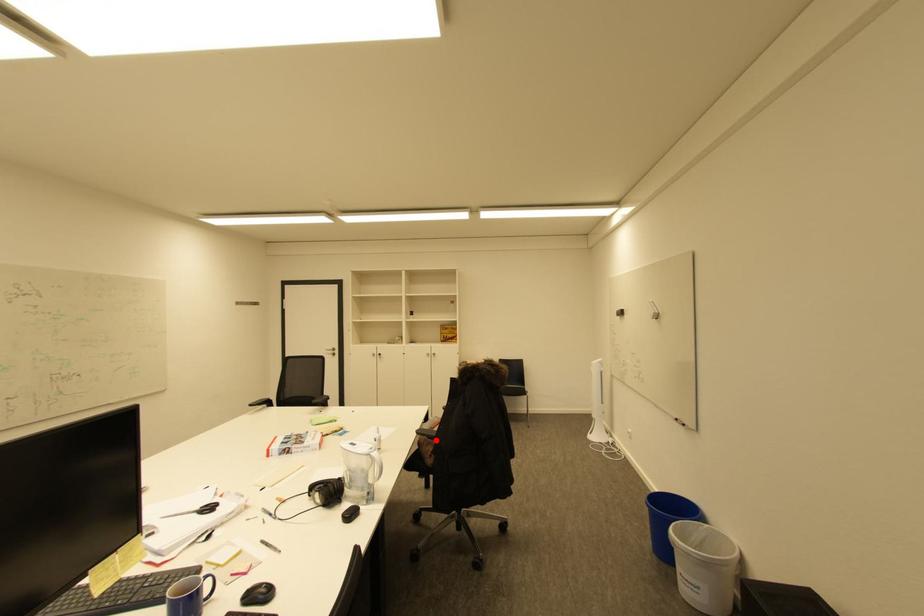
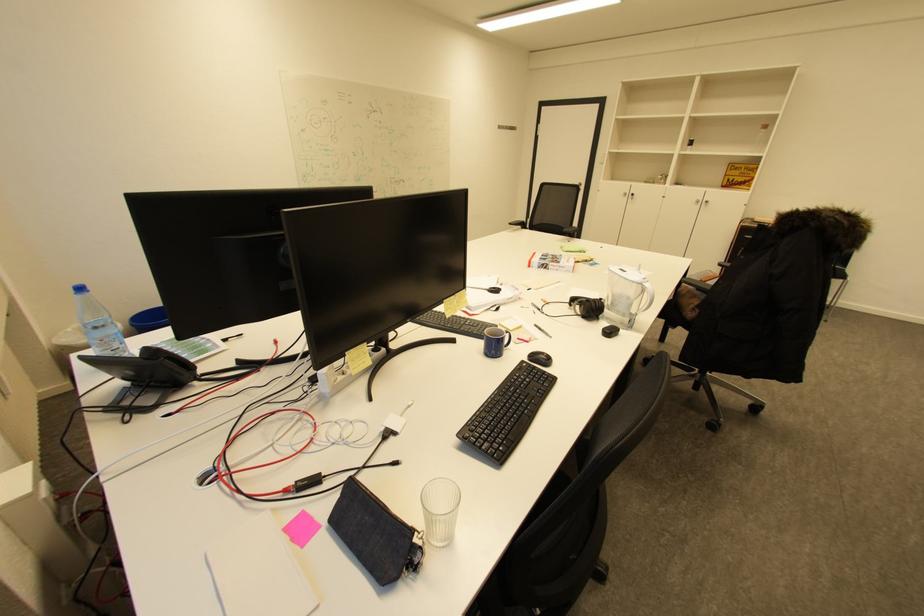
Question: I am providing you with two images of the same scene from different viewpoints. Image1 has a red point marked. In image2, the corresponding 3D location appears at what relative position? Reply with the corresponding letter.

Choices:
 (A) Closer
 (B) Farther

Answer: (A)